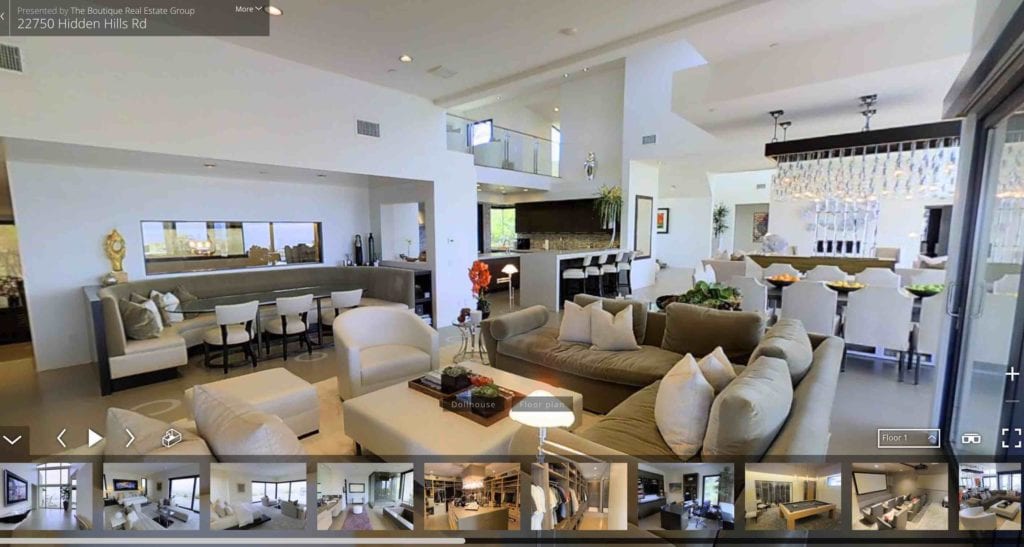
This screenshot has width=1024, height=547. I want to click on room pictures, so click(266, 503).